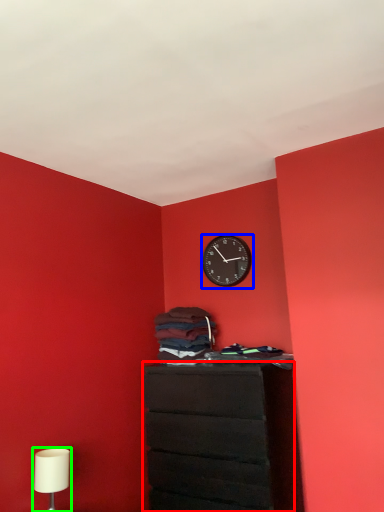
Question: Which object is positioned farthest from chest of drawers (highlighted by a red box)? Select from wall clock (highlighted by a blue box) and table lamp (highlighted by a green box).

Choices:
 (A) wall clock
 (B) table lamp

Answer: (A)